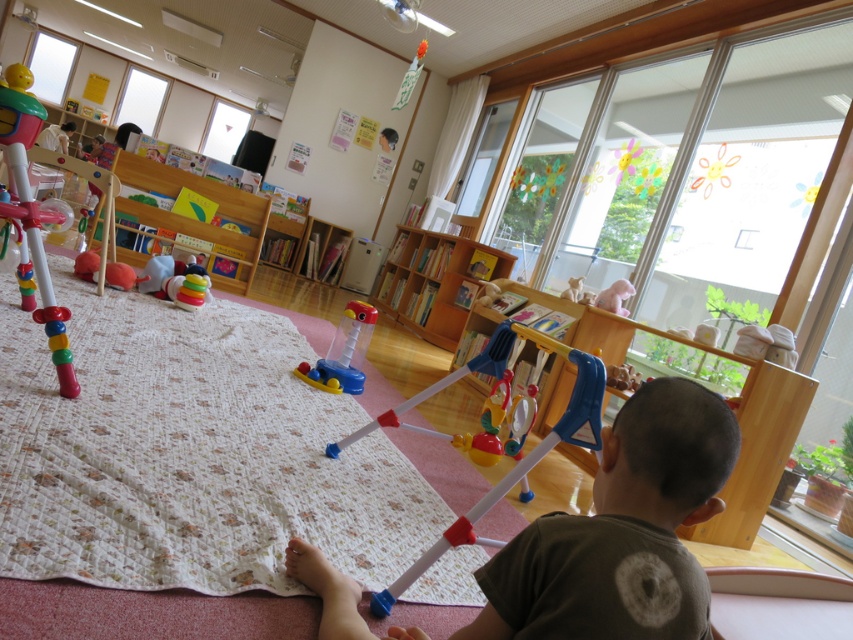
Between dark green cotton shirt at lower center and multicolored plastic toy at left, which one has less height?

With less height is dark green cotton shirt at lower center.

Can you confirm if dark green cotton shirt at lower center is wider than multicolored plastic toy at left?

Correct, the width of dark green cotton shirt at lower center exceeds that of multicolored plastic toy at left.

Between point (496, 595) and point (33, 266), which one is positioned behind?

The point (33, 266) is behind.

Locate an element on the screen. dark green cotton shirt at lower center is located at coordinates (666, 456).

Is dark green cotton shirt at lower center shorter than translucent plastic toy at center?

No.

Who is shorter, dark green cotton shirt at lower center or translucent plastic toy at center?

translucent plastic toy at center

Identify the location of dark green cotton shirt at lower center. point(666,456).

Find the location of a particular element. Image resolution: width=853 pixels, height=640 pixels. dark green cotton shirt at lower center is located at coordinates (666, 456).

Is multicolored plastic toy at left shorter than translucent plastic toy at center?

No.

Between multicolored plastic toy at left and translucent plastic toy at center, which one has less height?

translucent plastic toy at center

Is point (41, 112) positioned in front of point (329, 360)?

Yes, point (41, 112) is closer to viewer.

In order to click on multicolored plastic toy at left in this screenshot , I will do `click(32, 216)`.